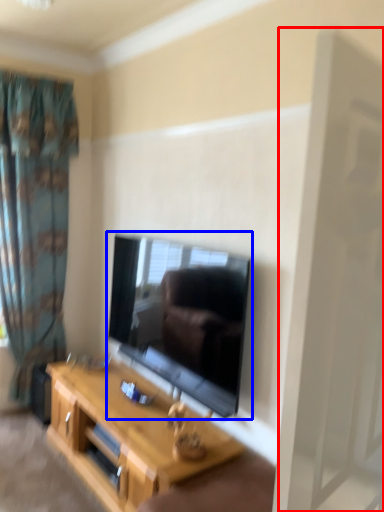
Question: Among these objects, which one is farthest to the camera, screen door (highlighted by a red box) or television (highlighted by a blue box)?

Choices:
 (A) screen door
 (B) television

Answer: (B)